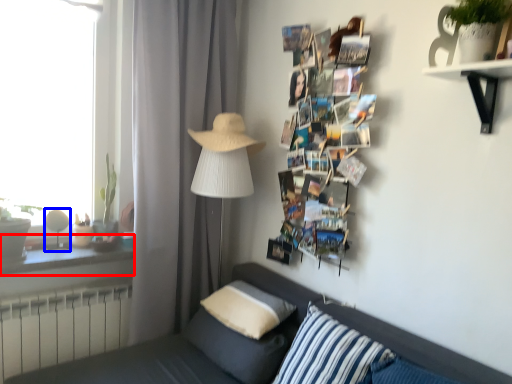
Question: Which object appears closest to the camera in this image, window sill (highlighted by a red box) or table lamp (highlighted by a blue box)?

Choices:
 (A) window sill
 (B) table lamp

Answer: (A)